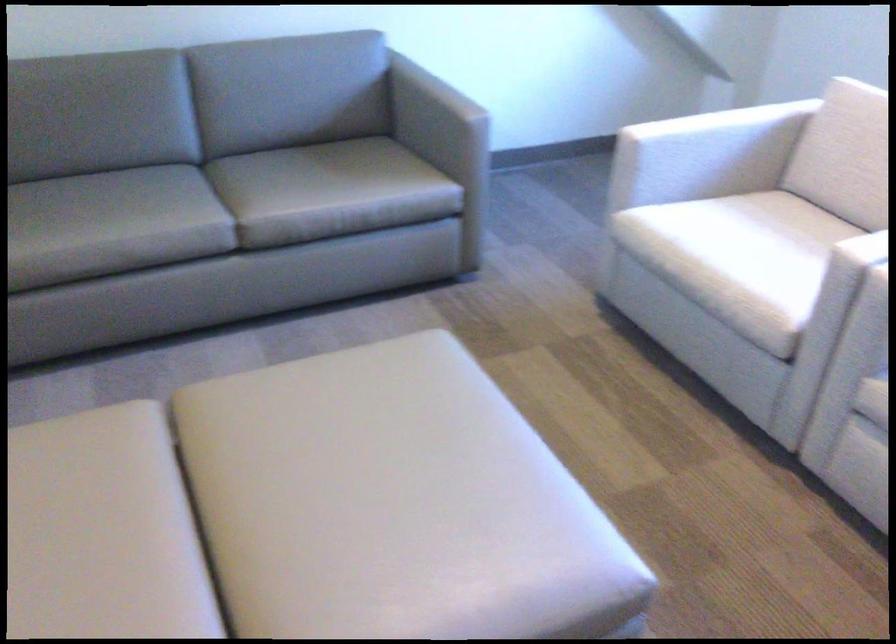
Where would you sit the white chair sitting surface? Please return your answer as a coordinate pair (x, y).

(737, 261)